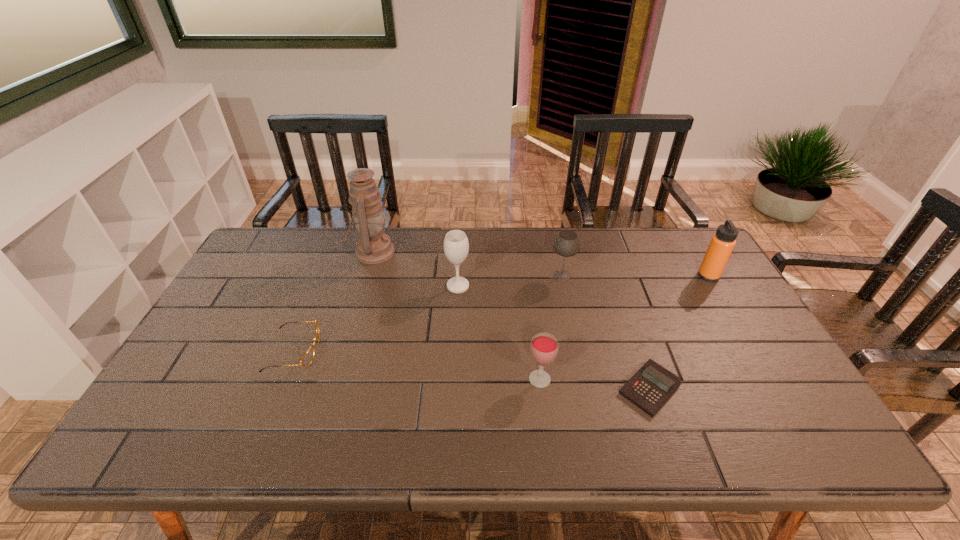
I want to click on object positioned at the near edge, so click(652, 385).

Where is `object that is at the right edge`? Image resolution: width=960 pixels, height=540 pixels. object that is at the right edge is located at coordinates (722, 243).

Find the location of `object that is at the far right corner`. object that is at the far right corner is located at coordinates (722, 243).

Find the location of a particular element. free location at the far edge of the desktop is located at coordinates (432, 231).

The image size is (960, 540). In the image, there is a desktop. Identify the location of blank space at the near edge. (651, 434).

Where is `vacant space at the left edge of the desktop`? The height and width of the screenshot is (540, 960). vacant space at the left edge of the desktop is located at coordinates (241, 353).

You are a GUI agent. You are given a task and a screenshot of the screen. Output one action in this format:
    pyautogui.click(x=<x>, y=<y>)
    Task: Click on the free location at the right edge
    
    Given the screenshot: What is the action you would take?
    pyautogui.click(x=691, y=285)

Locate an element on the screen. free space at the far right corner of the desktop is located at coordinates (683, 233).

I want to click on free space between the spectacles and the thermos bottle, so click(501, 313).

Where is `free point between the rightmost object and the tallest object`? free point between the rightmost object and the tallest object is located at coordinates (540, 264).